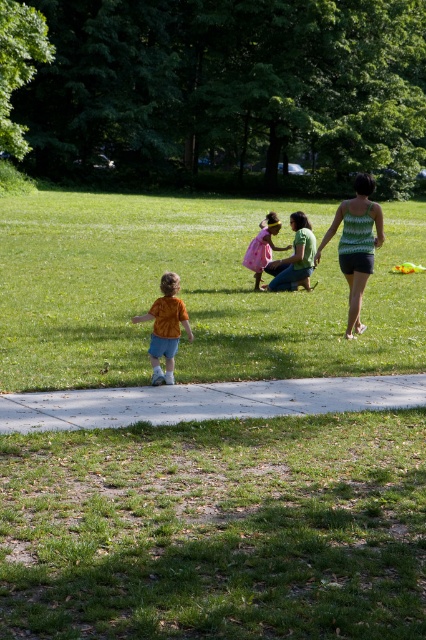
At what (x,y) coordinates should I click in order to perform the action: click on white concrete sidewalk at lower center. Please return your answer as a coordinate pair (x, y). Looking at the image, I should click on (206, 401).

Which is more to the left, white concrete sidewalk at lower center or green textured tank top at center?

white concrete sidewalk at lower center

Who is more distant from viewer, (19,406) or (322,248)?

The point (322,248) is behind.

Find the location of a particular element. This screenshot has width=426, height=640. white concrete sidewalk at lower center is located at coordinates (206, 401).

Based on the photo, can you confirm if green grass at center is wider than orange cotton shirt at center?

Yes.

Is point (288, 332) positioned behind point (143, 320)?

That is True.

Locate an element on the screen. Image resolution: width=426 pixels, height=640 pixels. green grass at center is located at coordinates (190, 292).

Between green grass at center and white concrete sidewalk at lower center, which one has less height?

Standing shorter between the two is white concrete sidewalk at lower center.

Does green grass at center have a greater height compared to white concrete sidewalk at lower center?

Indeed, green grass at center has a greater height compared to white concrete sidewalk at lower center.

Measure the distance between green grass at center and camera.

green grass at center is 9.95 meters from camera.

You are a GUI agent. You are given a task and a screenshot of the screen. Output one action in this format:
    pyautogui.click(x=<x>, y=<y>)
    Task: Click on the green grass at center
    Image resolution: width=426 pixels, height=640 pixels.
    Given the screenshot: What is the action you would take?
    pyautogui.click(x=190, y=292)